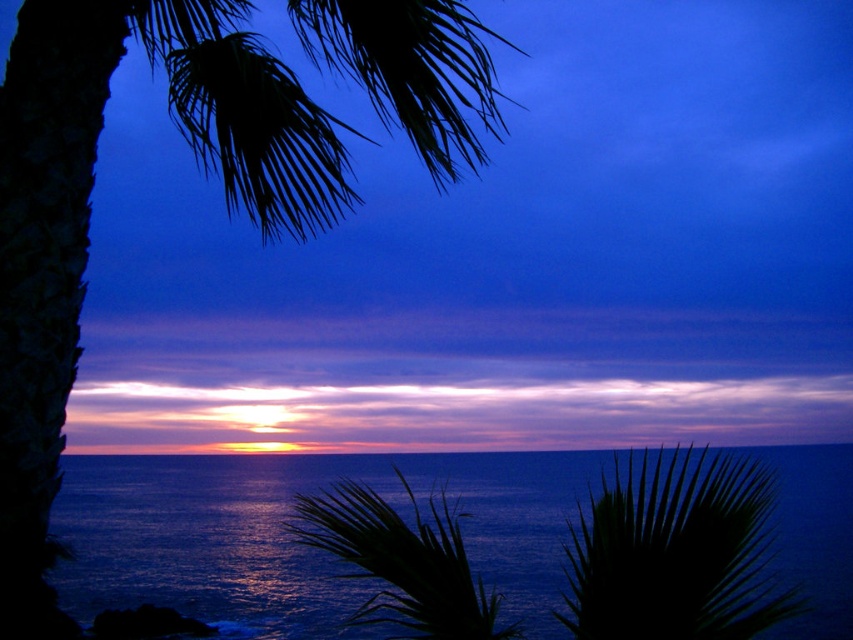
You are standing on the beach looking at the sunset. You see the silky green fronds at upper left and the green leafy palm at center. Which one is positioned more to the east?

The silky green fronds at upper left is positioned more to the east because it is to the left of the green leafy palm at center, and since the sun is setting in the west, the left side of the image would correspond to the east direction.

You are a photographer trying to capture the sunset reflection on the water. You notice the blue liquid water at center is at point (x=289, y=536). If you want to position your camera exactly where the water is, where should you place it?

You should position your camera exactly at point (x=289, y=536) where the blue liquid water at center is located to capture the reflection.